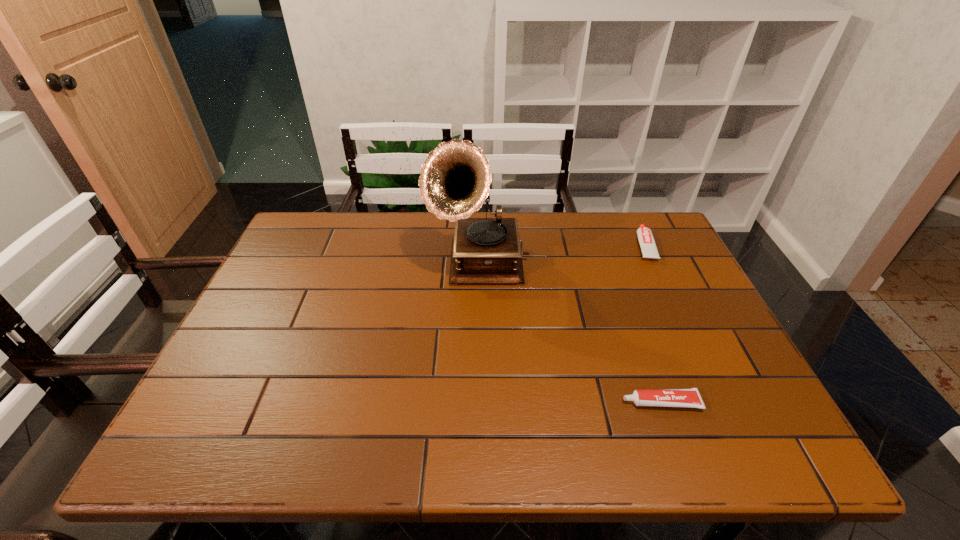
This screenshot has width=960, height=540. What are the coordinates of `object that is the nearest to the nearest object` in the screenshot? It's located at (454, 182).

Locate an element on the screen. the closest object relative to the rightmost object is located at coordinates (454, 182).